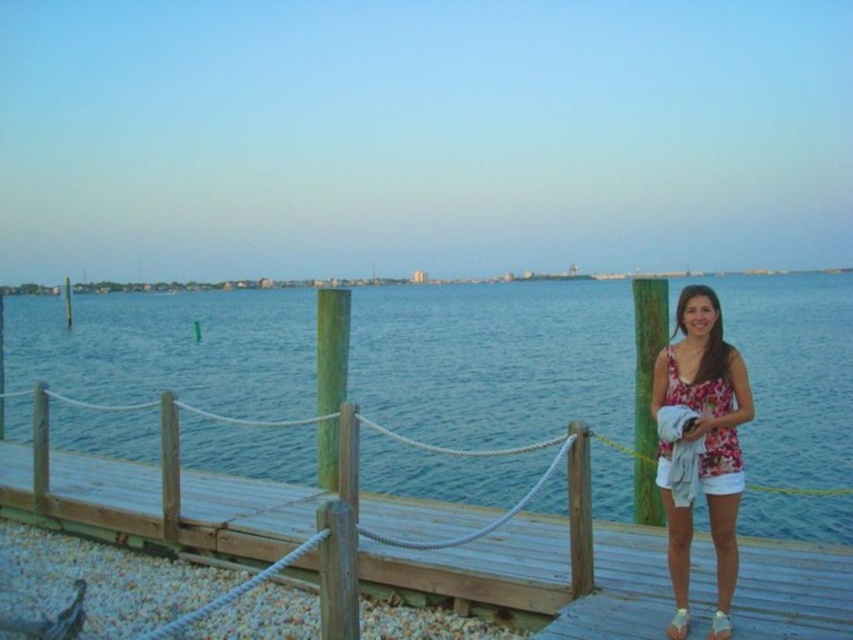
Between point (554, 326) and point (67, 467), which one is positioned in front?

Point (67, 467)

The height and width of the screenshot is (640, 853). What do you see at coordinates (494, 360) in the screenshot?
I see `blue water at center` at bounding box center [494, 360].

Is point (129, 387) positioned in front of point (469, 547)?

No, (129, 387) is behind (469, 547).

Find the location of `blue water at center`. blue water at center is located at coordinates (494, 360).

Who is shorter, blue water at center or floral fabric top at center?

Standing shorter between the two is floral fabric top at center.

Does blue water at center appear on the right side of floral fabric top at center?

Correct, you'll find blue water at center to the right of floral fabric top at center.

Where is `blue water at center`? This screenshot has height=640, width=853. blue water at center is located at coordinates (494, 360).

Is wooden dock at center wider than floral fabric top at center?

Correct, the width of wooden dock at center exceeds that of floral fabric top at center.

Is point (108, 531) positioned behind point (735, 541)?

That is True.

I want to click on wooden dock at center, so click(x=358, y=532).